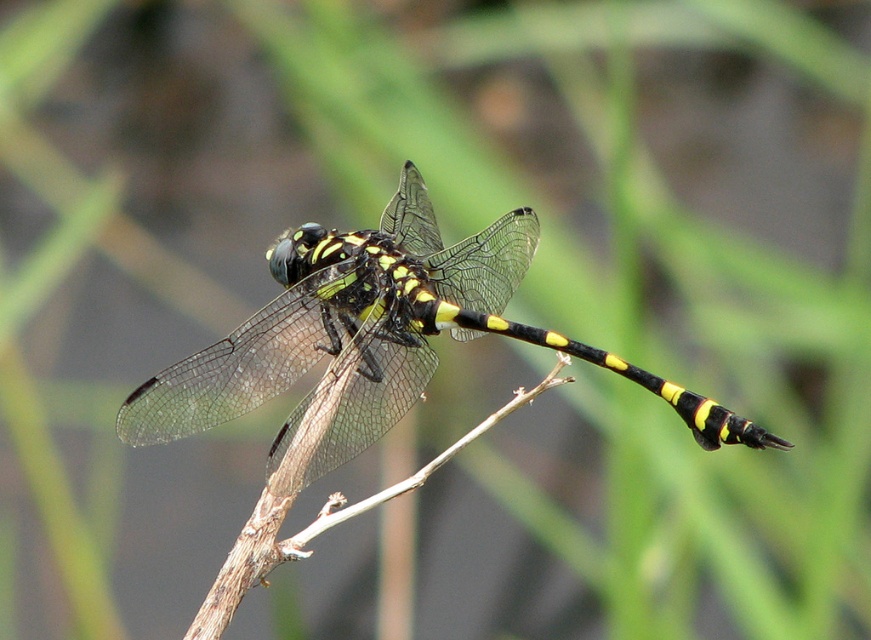
You are an entomologist observing a dragonfly in a natural habitat. You notice a point marked at coordinates (x=375, y=340). Based on the scene, what does this point likely indicate?

The point at (x=375, y=340) marks the location of the yellow and black dragonfly at the center of the scene.